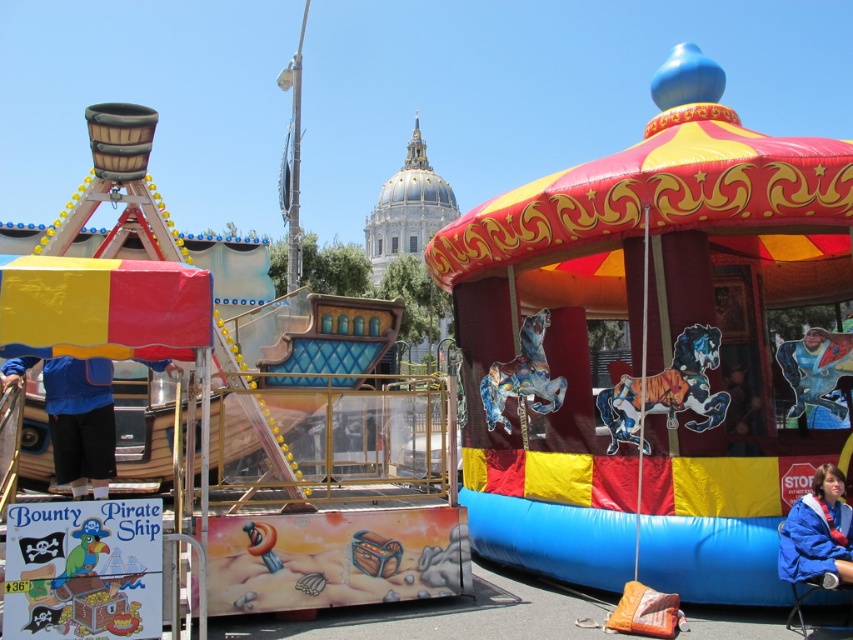
Does blue fabric jacket at left have a lesser width compared to blue fabric jacket at lower right?

No, blue fabric jacket at left is not thinner than blue fabric jacket at lower right.

Who is lower down, blue fabric jacket at left or blue fabric jacket at lower right?

Positioned lower is blue fabric jacket at lower right.

Find the location of a particular element. The height and width of the screenshot is (640, 853). blue fabric jacket at left is located at coordinates (80, 422).

Does rubberized inflatable carousel at center appear over blue fabric jacket at left?

Indeed, rubberized inflatable carousel at center is positioned over blue fabric jacket at left.

Image resolution: width=853 pixels, height=640 pixels. Find the location of `rubberized inflatable carousel at center`. rubberized inflatable carousel at center is located at coordinates (659, 348).

Where is `rubberized inflatable carousel at center`? The width and height of the screenshot is (853, 640). rubberized inflatable carousel at center is located at coordinates (659, 348).

Does point (827, 224) come farther from viewer compared to point (776, 560)?

That is True.

In the scene shown: Can you confirm if rubberized inflatable carousel at center is positioned below blue fabric jacket at lower right?

Actually, rubberized inflatable carousel at center is above blue fabric jacket at lower right.

This screenshot has height=640, width=853. What are the coordinates of `rubberized inflatable carousel at center` in the screenshot? It's located at (659, 348).